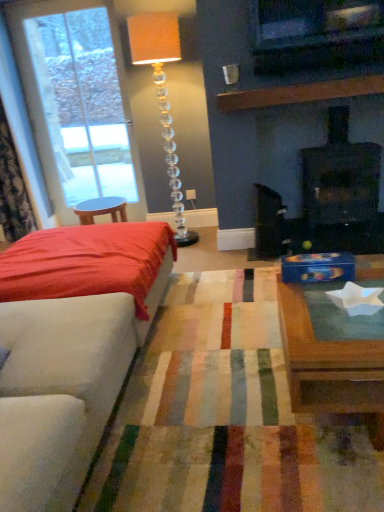
Where is `empty space that is ontop of satin red bed at left`? This screenshot has height=512, width=384. empty space that is ontop of satin red bed at left is located at coordinates (65, 246).